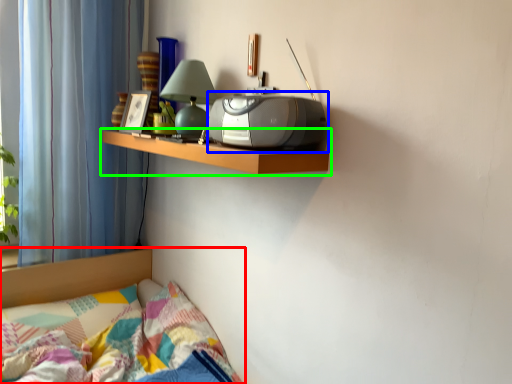
Question: Which object is the farthest from bed (highlighted by a red box)? Choose among these: stereo (highlighted by a blue box) or shelf (highlighted by a green box).

Choices:
 (A) stereo
 (B) shelf

Answer: (A)